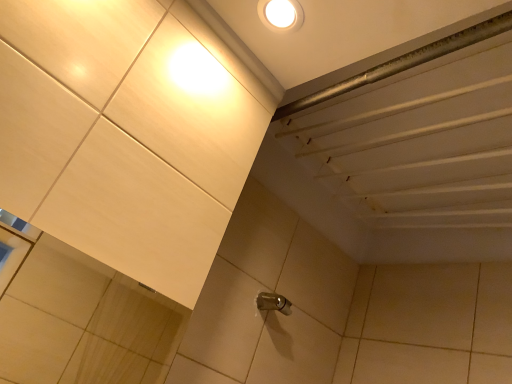
What do you see at coordinates (273, 303) in the screenshot? This screenshot has height=384, width=512. I see `satin nickel faucet at center` at bounding box center [273, 303].

At what (x,y) coordinates should I click in order to perform the action: click on satin nickel faucet at center. Please return your answer as a coordinate pair (x, y). This screenshot has height=384, width=512. Looking at the image, I should click on (273, 303).

Locate an element on the screen. The width and height of the screenshot is (512, 384). white glossy droplight at upper center is located at coordinates (281, 15).

What do you see at coordinates (281, 15) in the screenshot? This screenshot has height=384, width=512. I see `white glossy droplight at upper center` at bounding box center [281, 15].

You are a GUI agent. You are given a task and a screenshot of the screen. Output one action in this format:
    pyautogui.click(x=<x>, y=<y>)
    Task: Click on the satin nickel faucet at center
    This screenshot has width=512, height=384.
    Given the screenshot: What is the action you would take?
    pyautogui.click(x=273, y=303)

Between white glossy droplight at upper center and satin nickel faucet at center, which one appears on the left side from the viewer's perspective?

Positioned to the left is white glossy droplight at upper center.

In the image, is white glossy droplight at upper center positioned in front of or behind satin nickel faucet at center?

Clearly, white glossy droplight at upper center is in front of satin nickel faucet at center.

Between point (300, 8) and point (285, 301), which one is positioned behind?

The point (285, 301) is farther.

From the image's perspective, is white glossy droplight at upper center located above satin nickel faucet at center?

Indeed, from the image's perspective, white glossy droplight at upper center is shown above satin nickel faucet at center.

From a real-world perspective, between white glossy droplight at upper center and satin nickel faucet at center, who is vertically lower?

satin nickel faucet at center is physically lower.

Does white glossy droplight at upper center have a greater width compared to satin nickel faucet at center?

Yes.

Who is shorter, white glossy droplight at upper center or satin nickel faucet at center?

With less height is white glossy droplight at upper center.

Who is bigger, white glossy droplight at upper center or satin nickel faucet at center?

With larger size is satin nickel faucet at center.

Is white glossy droplight at upper center completely or partially outside of satin nickel faucet at center?

Yes, white glossy droplight at upper center is located beyond the bounds of satin nickel faucet at center.

Are white glossy droplight at upper center and satin nickel faucet at center located far from each other?

white glossy droplight at upper center is near satin nickel faucet at center, not far away.

From the picture: Is white glossy droplight at upper center facing away from satin nickel faucet at center?

No, satin nickel faucet at center is not at the back of white glossy droplight at upper center.

The width and height of the screenshot is (512, 384). What are the coordinates of `droplight that appears above the satin nickel faucet at center (from a real-world perspective)` in the screenshot? It's located at (281, 15).

Between satin nickel faucet at center and white glossy droplight at upper center, which one appears on the right side from the viewer's perspective?

satin nickel faucet at center is more to the right.

In the scene shown: Which object is further away from the camera, satin nickel faucet at center or white glossy droplight at upper center?

satin nickel faucet at center is more distant.

Is point (286, 305) in front of point (290, 13)?

No, (286, 305) is behind (290, 13).

Looking at this image, from the image's perspective, who appears lower, satin nickel faucet at center or white glossy droplight at upper center?

satin nickel faucet at center appears lower in the image.

From a real-world perspective, which is physically below, satin nickel faucet at center or white glossy droplight at upper center?

In real-world perspective, satin nickel faucet at center is lower.

Considering the sizes of satin nickel faucet at center and white glossy droplight at upper center in the image, is satin nickel faucet at center wider or thinner than white glossy droplight at upper center?

satin nickel faucet at center is thinner than white glossy droplight at upper center.

Between satin nickel faucet at center and white glossy droplight at upper center, which one has more height?

satin nickel faucet at center is taller.

Considering the relative sizes of satin nickel faucet at center and white glossy droplight at upper center in the image provided, is satin nickel faucet at center bigger than white glossy droplight at upper center?

Yes.

Is satin nickel faucet at center located outside white glossy droplight at upper center?

Indeed, satin nickel faucet at center is completely outside white glossy droplight at upper center.

Is satin nickel faucet at center placed right next to white glossy droplight at upper center?

satin nickel faucet at center and white glossy droplight at upper center are clearly separated.

Is satin nickel faucet at center oriented towards white glossy droplight at upper center?

No.

Where is `droplight on the left of satin nickel faucet at center`? Image resolution: width=512 pixels, height=384 pixels. droplight on the left of satin nickel faucet at center is located at coordinates (281, 15).

At what (x,y) coordinates should I click in order to perform the action: click on plumbing fixture below the white glossy droplight at upper center (from the image's perspective). Please return your answer as a coordinate pair (x, y). Looking at the image, I should click on (273, 303).

The width and height of the screenshot is (512, 384). In order to click on plumbing fixture that is under the white glossy droplight at upper center (from a real-world perspective) in this screenshot , I will do `click(273, 303)`.